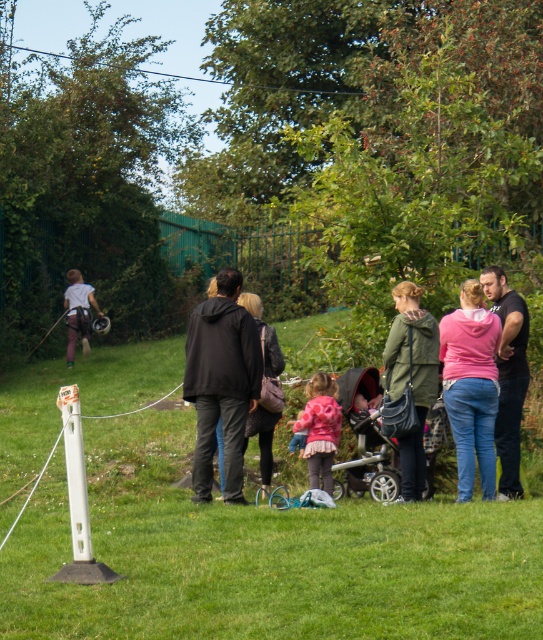
You are a photographer setting up a shoot in the park. You need to ensure that the black matte shirt at right and the silver metallic stroller at center are both visible in the frame. Based on their positions, which object is closer to the camera?

The black matte shirt at right is positioned over the silver metallic stroller at center, meaning it is closer to the camera.

You are a photographer trying to capture a photo of the silver metallic stroller at center and the black matte shirt at right. Which object should you focus on first if you want to ensure both are in the frame without moving the camera?

The black matte shirt at right is bigger than the silver metallic stroller at center, so you should focus on the black matte shirt at right first to ensure it fits within the frame.